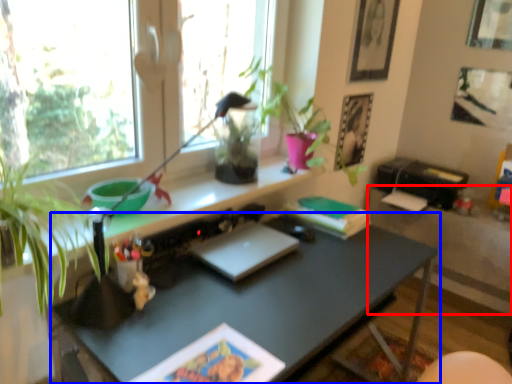
Question: Which point is closer to the camera, table (highlighted by a red box) or desk (highlighted by a blue box)?

Choices:
 (A) table
 (B) desk

Answer: (B)